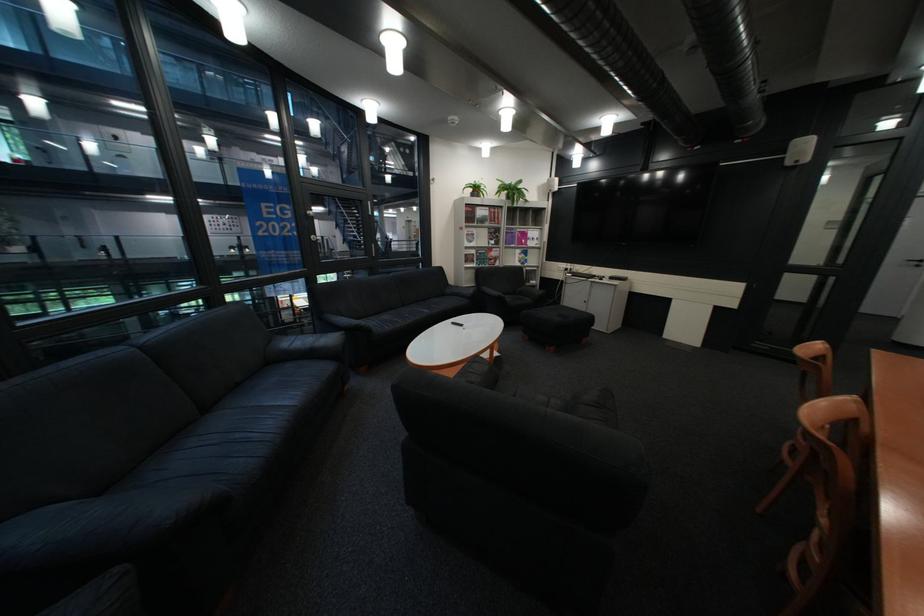
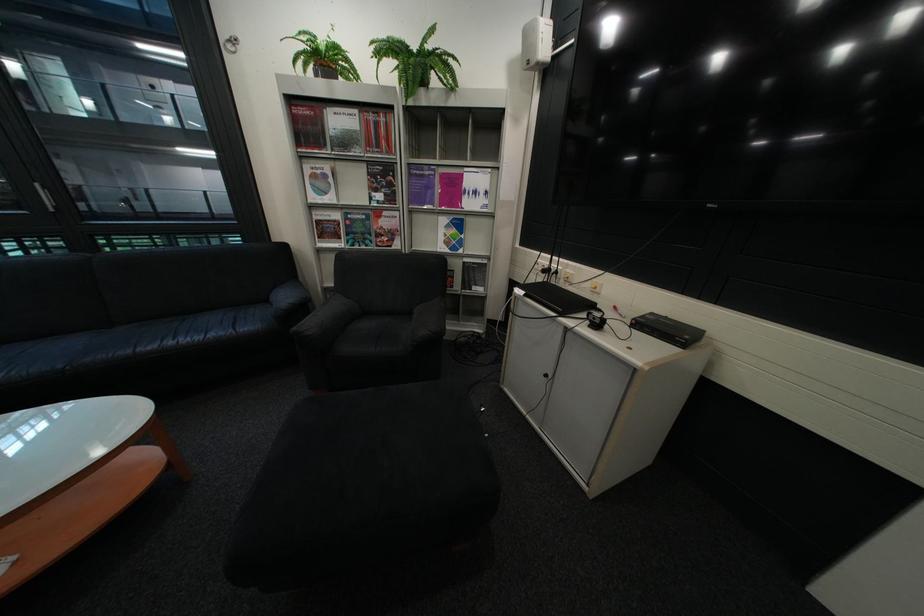
The point at [482,235] is marked in the first image. Where is the corresponding point in the second image?

(329, 177)